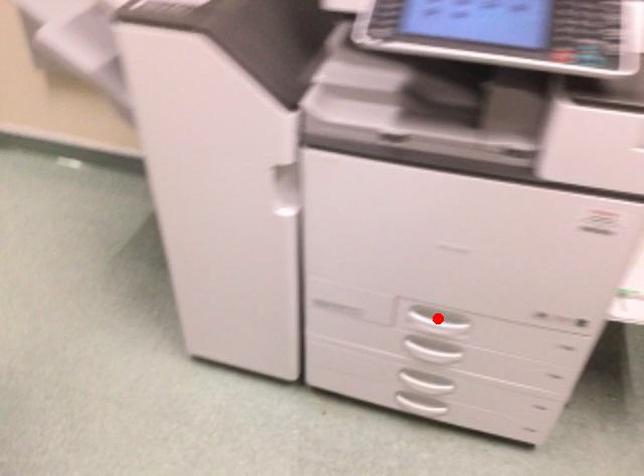
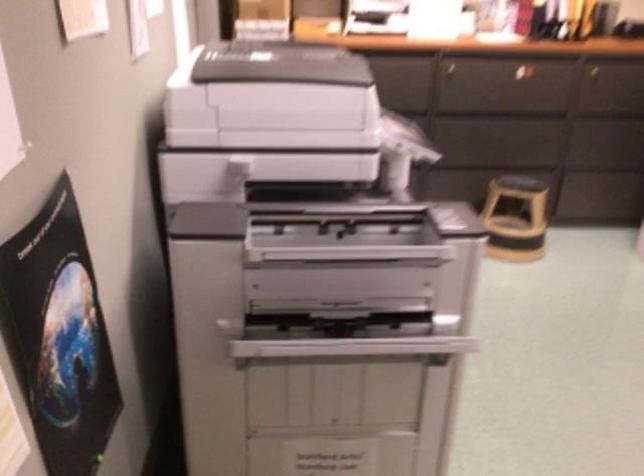
Question: I am providing you with two images of the same scene from different viewpoints. A red point is marked on the first image. Can you still see the location of the red point in image 2?

Choices:
 (A) Yes
 (B) No

Answer: (B)